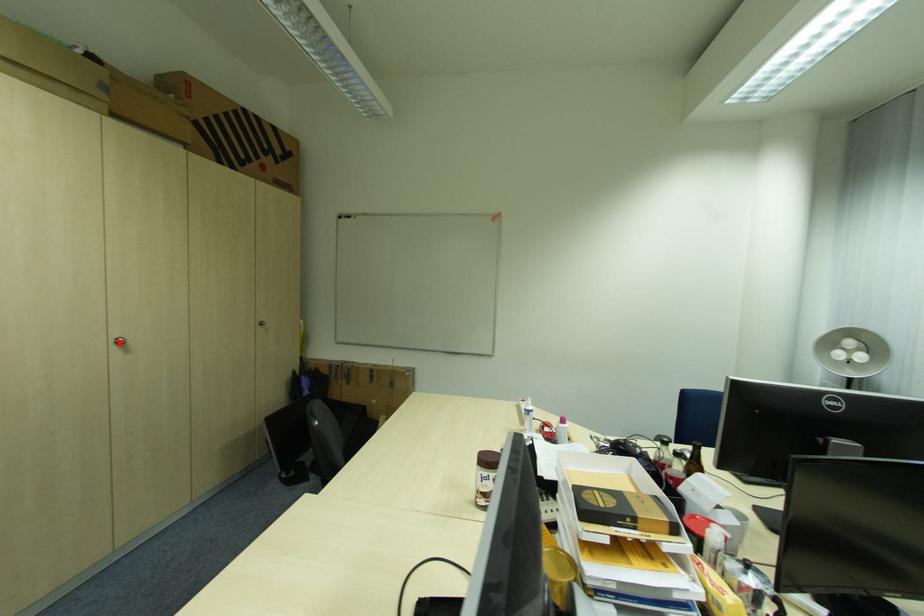
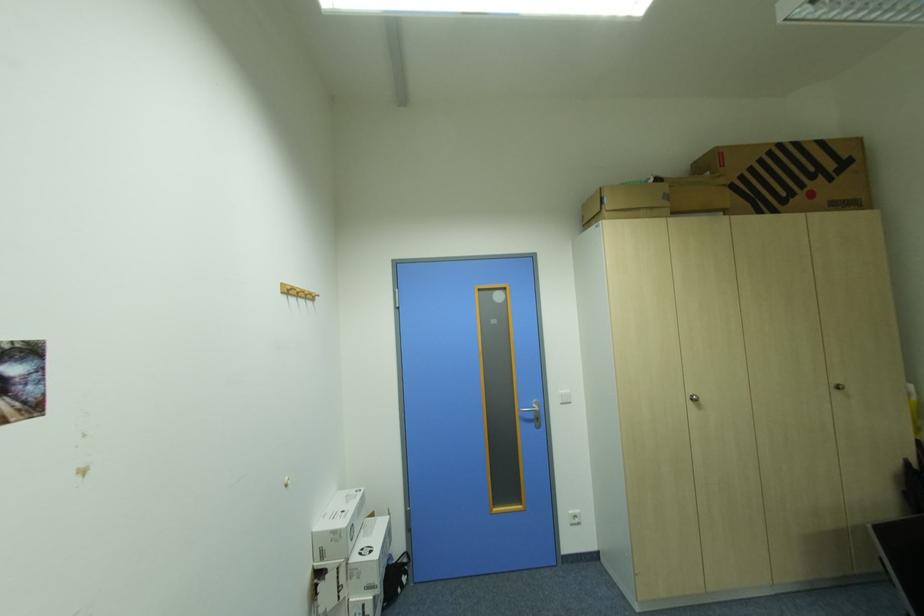
In the second image, find the point that corresponds to the highlighted location in the first image.

(697, 399)